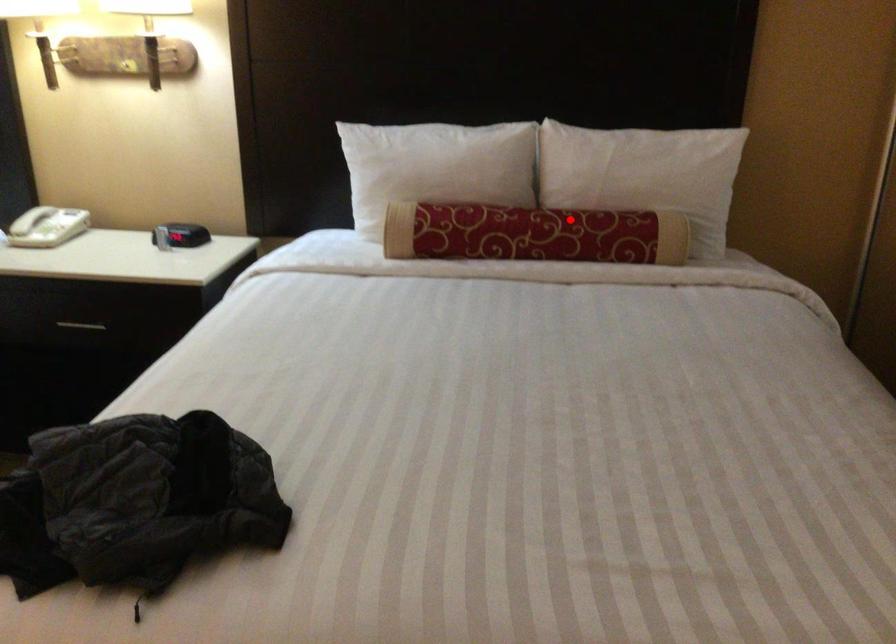
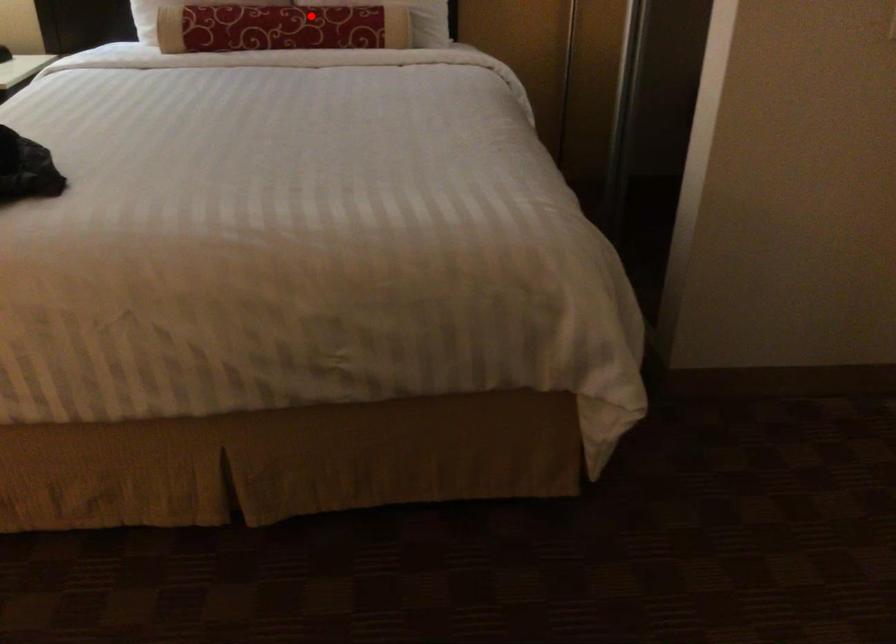
I am providing you with two images of the same scene from different viewpoints. A red point is marked on the first image and another point is marked on the second image. Does the point marked in image1 correspond to the same location as the one in image2?

Yes